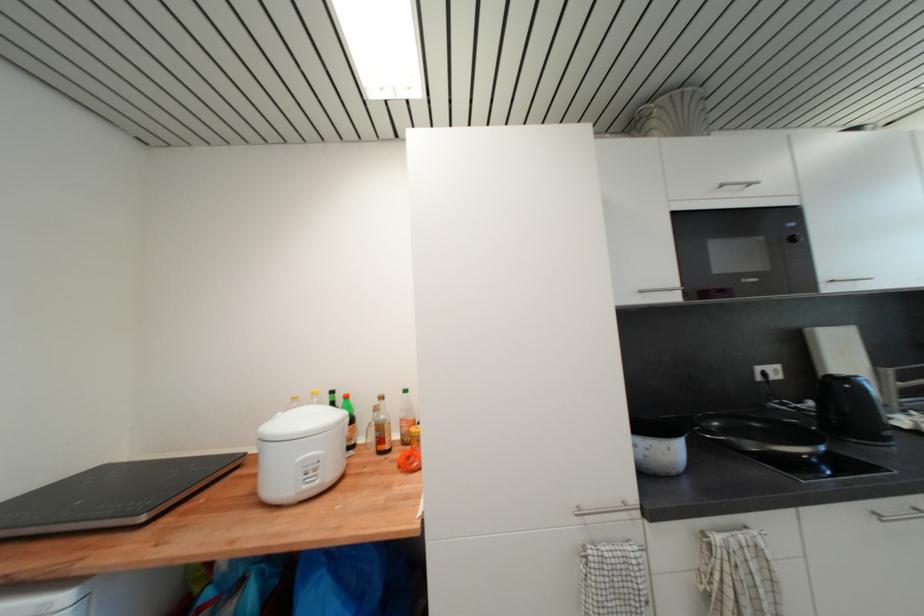
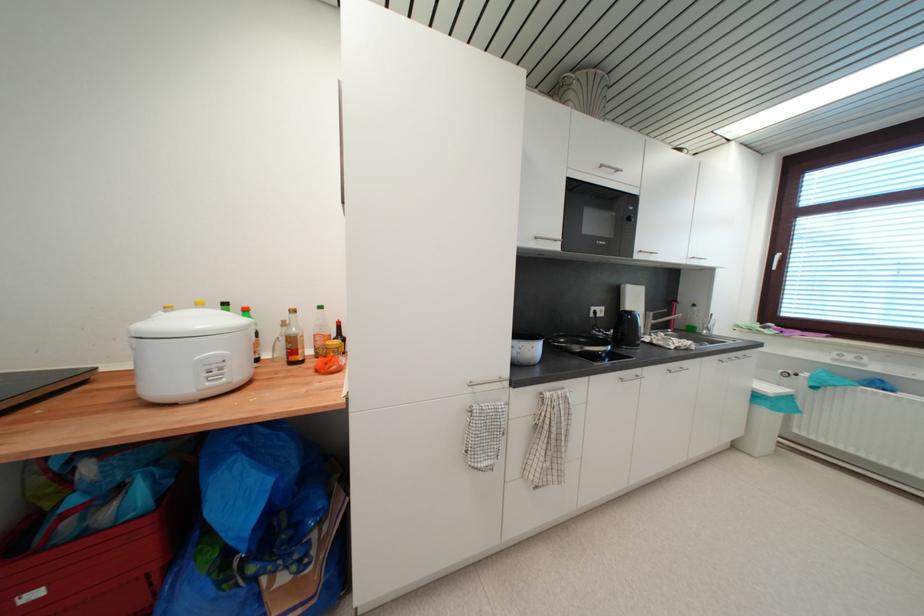
What movement of the cameraman would produce the second image?

The movement direction of the cameraman is left, backward.